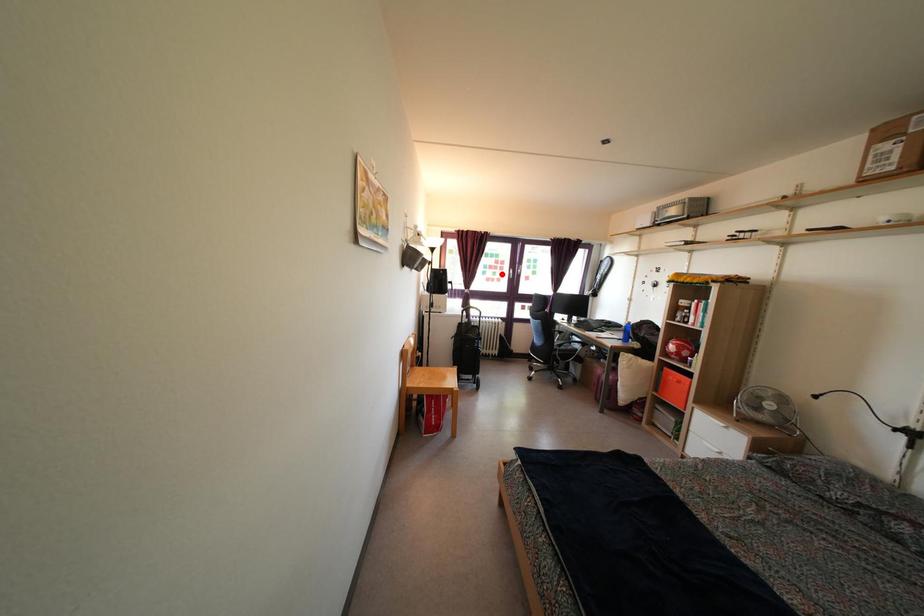
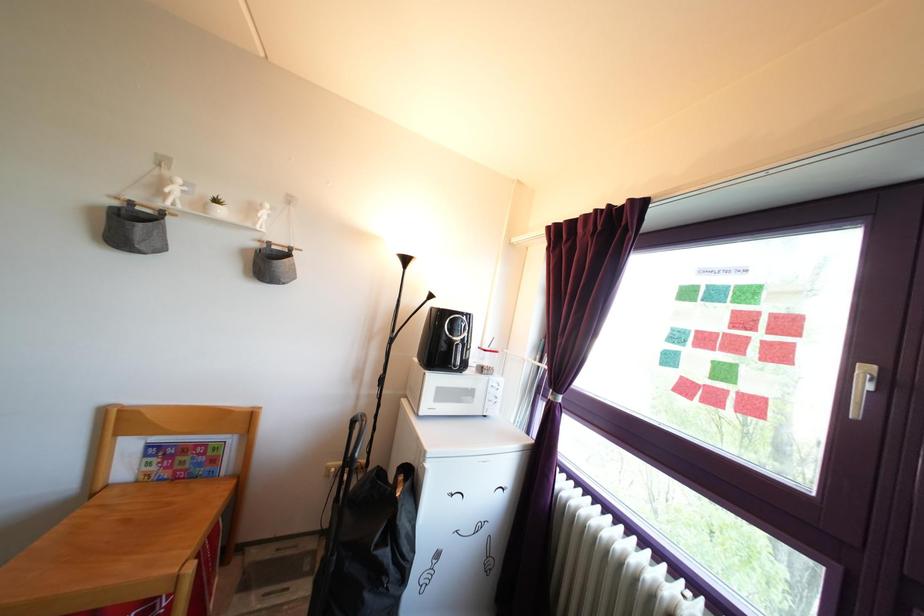
Question: I am providing you with two images of the same scene from different viewpoints. Given a red point in image1, look at the same physical point in image2. Is it:

Choices:
 (A) Closer to the viewpoint
 (B) Farther from the viewpoint

Answer: (B)